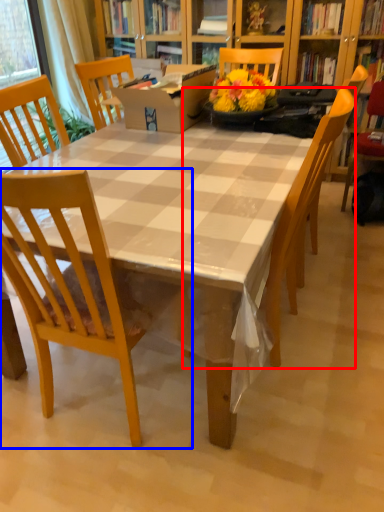
Question: Among these objects, which one is farthest to the camera, chair (highlighted by a red box) or chair (highlighted by a blue box)?

Choices:
 (A) chair
 (B) chair

Answer: (A)